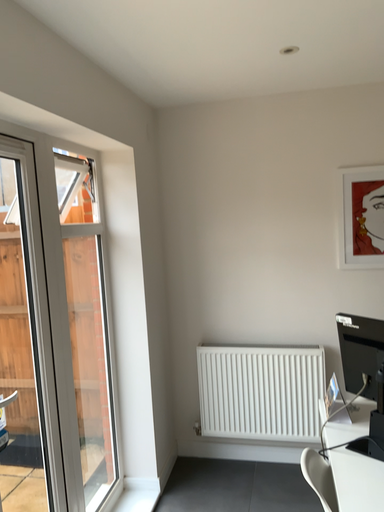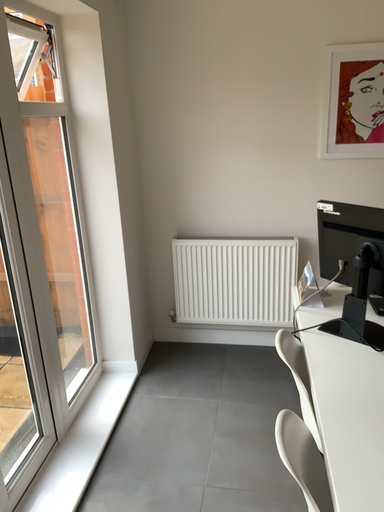
Question: Which way did the camera rotate in the video?

Choices:
 (A) rotated downward
 (B) rotated upward

Answer: (A)